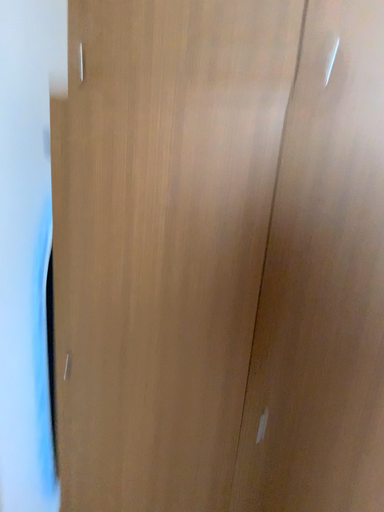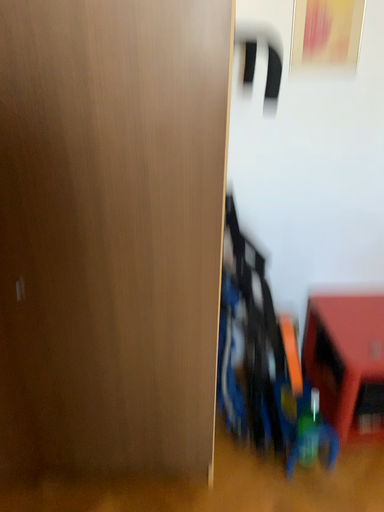
Question: Which way did the camera rotate in the video?

Choices:
 (A) rotated right
 (B) rotated left

Answer: (A)